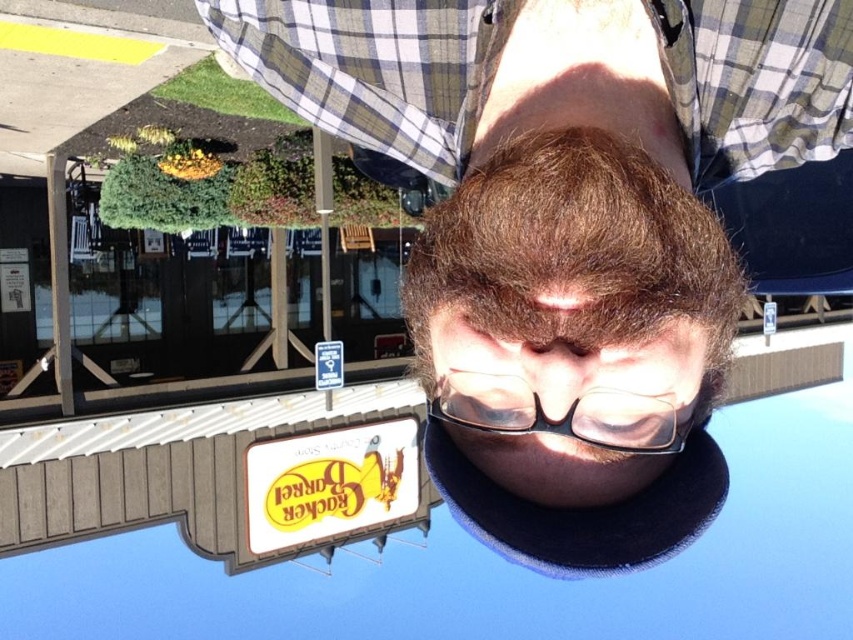
You are a photographer trying to capture the person in the image. You notice the brown matte hair at center and the transparent plastic glasses at center. Which object should you focus on first if you want to ensure both are in sharp focus, considering their sizes?

The brown matte hair at center has a larger size compared to the transparent plastic glasses at center, so focusing on the larger object first will help ensure both are in sharp focus.

You are standing in front of the image and want to determine which of the two points, point (335, 54) or point (471, 396), is closer to you. Based on the scene description, which point is nearer?

Point (335, 54) is further to the viewer than point (471, 396), so point (471, 396) is closer to you.